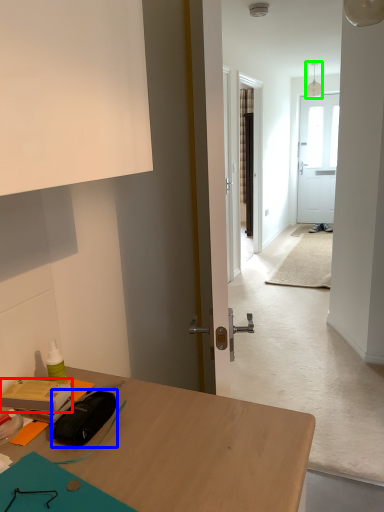
Question: Which object is positioned farthest from stationery (highlighted by a red box)? Select from stationery (highlighted by a blue box) and lamp (highlighted by a green box).

Choices:
 (A) stationery
 (B) lamp

Answer: (B)